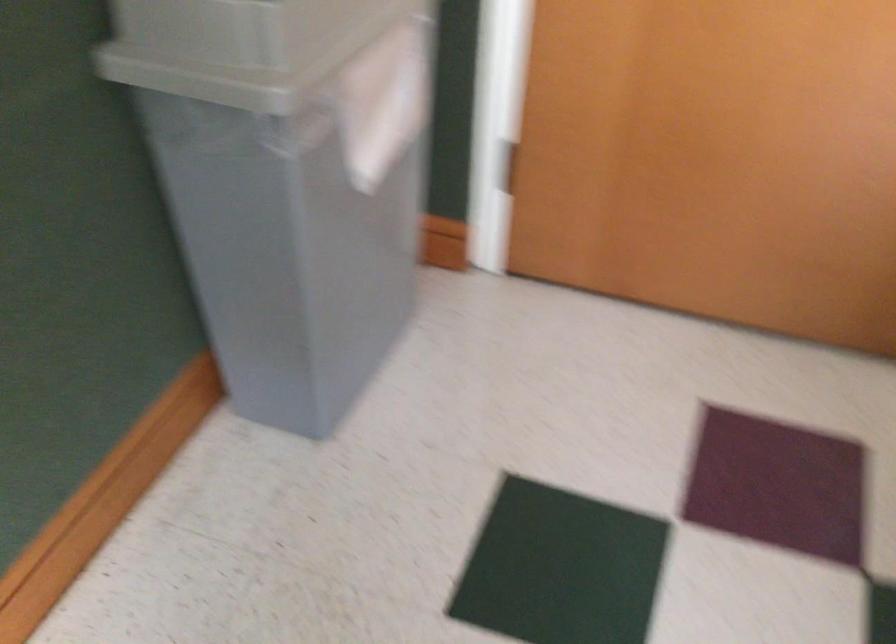
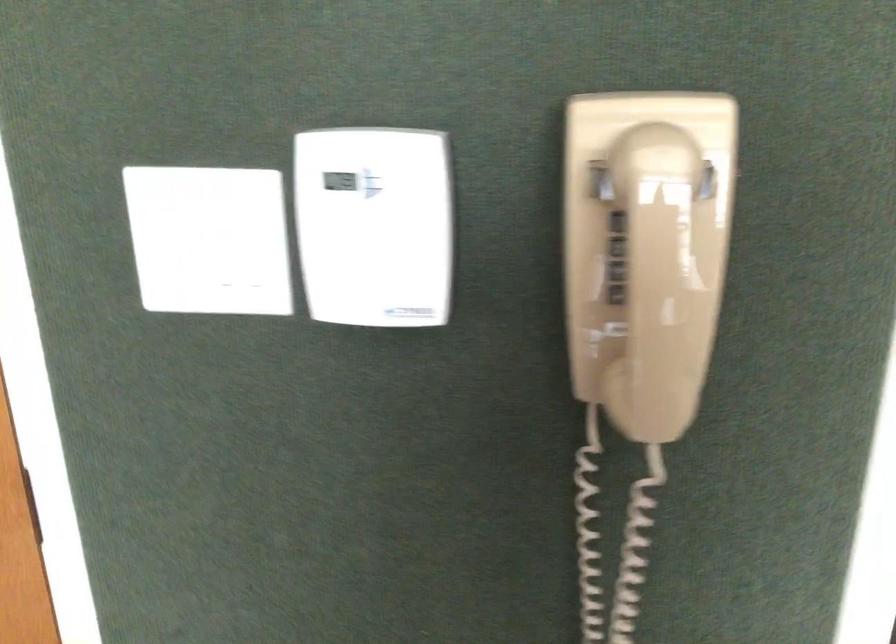
Question: Which direction would the cameraman need to move to produce the second image? Reply with the corresponding letter.

Choices:
 (A) Left
 (B) Right
 (C) Forward
 (D) Backward

Answer: (B)